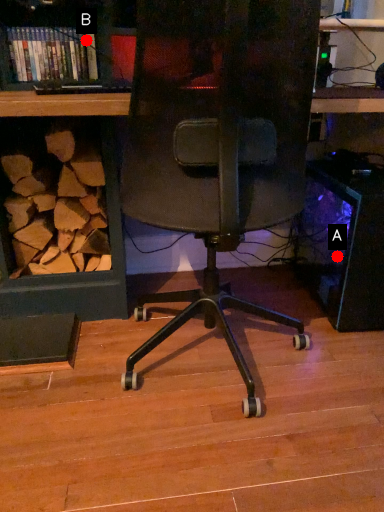
Question: Two points are circled on the image, labeled by A and B beside each circle. Which point appears closest to the camera in this image?

Choices:
 (A) A is closer
 (B) B is closer

Answer: (B)